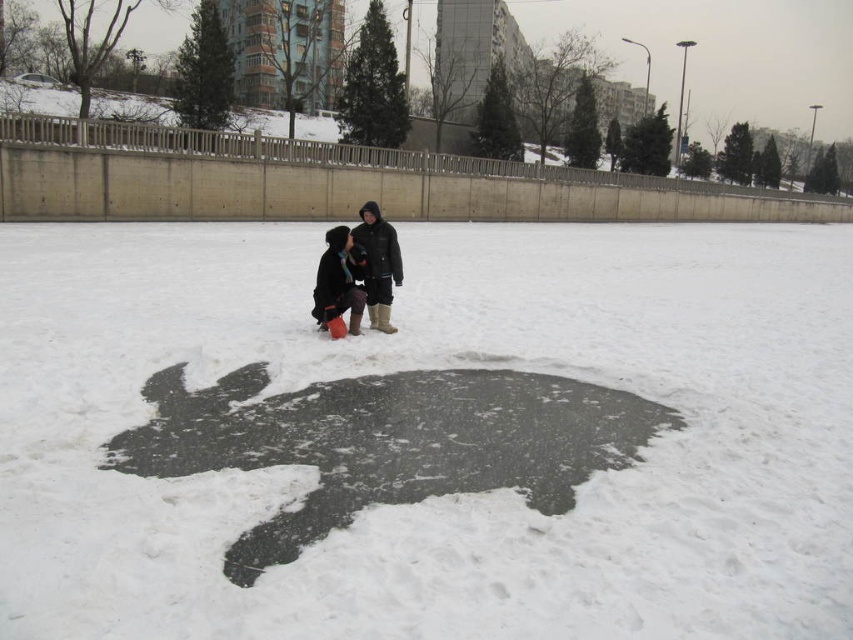
Can you confirm if black matte snow at center is taller than dark gray woolen coat at center?

In fact, black matte snow at center may be shorter than dark gray woolen coat at center.

Between black matte snow at center and dark gray woolen coat at center, which one has more height?

With more height is dark gray woolen coat at center.

This screenshot has height=640, width=853. I want to click on black matte snow at center, so click(x=444, y=497).

Does point (378, 298) come behind point (358, 284)?

Yes, point (378, 298) is behind point (358, 284).

Does dark gray woolen coat at center have a smaller size compared to dark brown fur coat at center?

Actually, dark gray woolen coat at center might be larger than dark brown fur coat at center.

Is point (380, 262) closer to viewer compared to point (323, 280)?

That is False.

Where is `dark gray woolen coat at center`? This screenshot has width=853, height=640. dark gray woolen coat at center is located at coordinates (358, 273).

Is black matte snow at center thinner than dark brown fur coat at center?

No.

Can you confirm if black matte snow at center is positioned below dark brown fur coat at center?

Incorrect, black matte snow at center is not positioned below dark brown fur coat at center.

I want to click on black matte snow at center, so click(x=444, y=497).